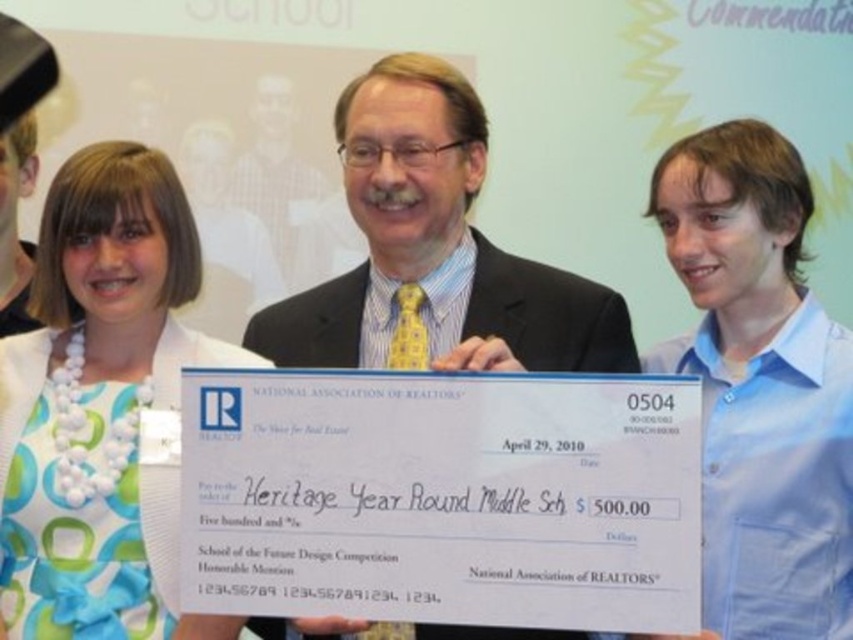
Question: Which point is closer to the camera taking this photo?

Choices:
 (A) 189,212
 (B) 286,282
 (C) 730,291

Answer: (A)

Question: Is white pearl necklace at upper left smaller than matte yellow tie at center?

Choices:
 (A) yes
 (B) no

Answer: (B)

Question: Which point appears farthest from the camera in this image?

Choices:
 (A) (76, 330)
 (B) (288, 193)
 (C) (726, 465)

Answer: (B)

Question: Is white fabric dress at upper left to the left of matte black suit at center from the viewer's perspective?

Choices:
 (A) yes
 (B) no

Answer: (A)

Question: Where is white fabric dress at upper left located in relation to matte black suit at center in the image?

Choices:
 (A) above
 (B) below

Answer: (B)

Question: Estimate the real-world distances between objects in this image. Which object is farther from the white fabric dress at upper left?

Choices:
 (A) white pearl necklace at upper left
 (B) matte black suit at center
 (C) matte yellow tie at center

Answer: (A)